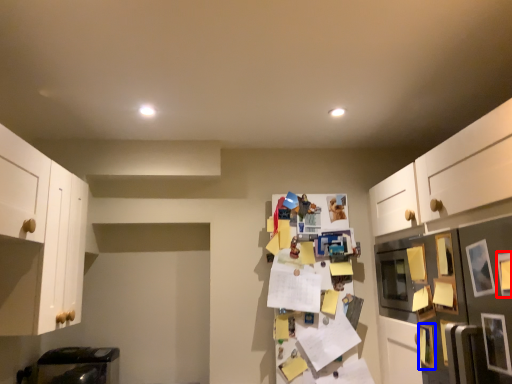
Question: Among these objects, which one is nearest to the camera, picture frame (highlighted by a red box) or picture frame (highlighted by a blue box)?

Choices:
 (A) picture frame
 (B) picture frame

Answer: (A)